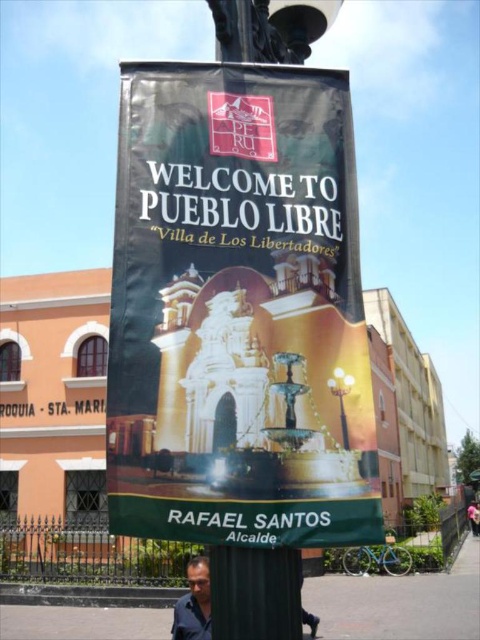
You are attending a town festival and notice two black items in the scene. One is the black fabric banner at center and the other is the matte black shirt at lower center. Which of these items is larger?

The black fabric banner at center is bigger than the matte black shirt at lower center.

You are a city planner assessing the visibility of the black fabric banner at center and the metallic silver streetlight at upper center in the image. Which object is taller?

The black fabric banner at center is much taller than the metallic silver streetlight at upper center.